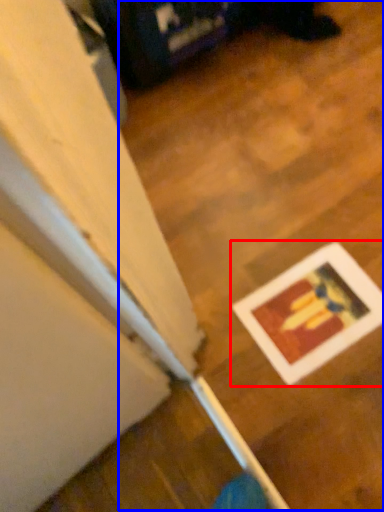
Question: Which of the following is the farthest to the observer, picture frame (highlighted by a red box) or wood (highlighted by a blue box)?

Choices:
 (A) picture frame
 (B) wood

Answer: (A)